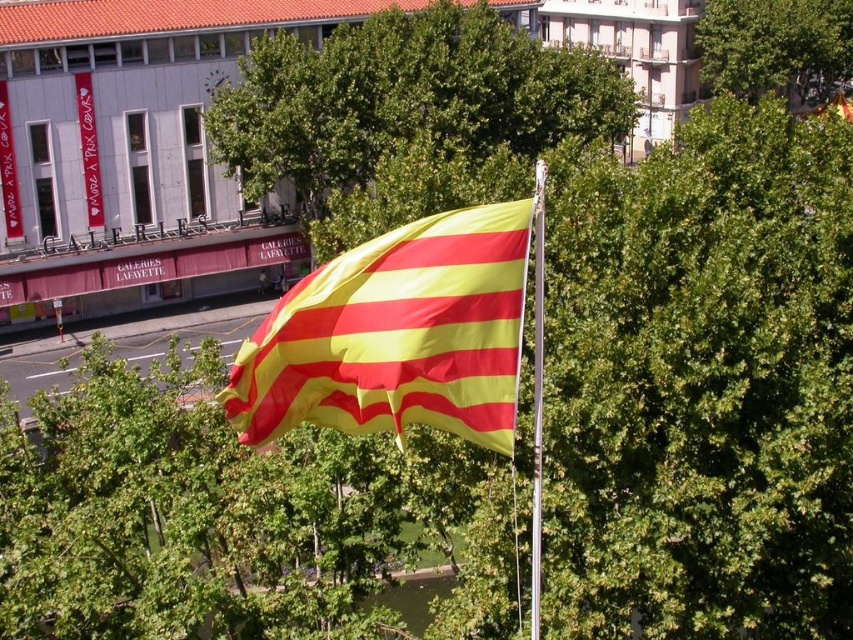
Who is taller, green leafy tree at center or green leafy tree at upper center?

With more height is green leafy tree at center.

Where is `green leafy tree at center`? Image resolution: width=853 pixels, height=640 pixels. green leafy tree at center is located at coordinates (405, 104).

The height and width of the screenshot is (640, 853). I want to click on green leafy tree at center, so click(x=405, y=104).

Is green leafy tree at upper center behind silver metallic flag pole at center?

Yes.

Where is `green leafy tree at upper center`? The width and height of the screenshot is (853, 640). green leafy tree at upper center is located at coordinates (775, 48).

You are a GUI agent. You are given a task and a screenshot of the screen. Output one action in this format:
    pyautogui.click(x=<x>, y=<y>)
    Task: Click on the green leafy tree at upper center
    This screenshot has height=640, width=853.
    Given the screenshot: What is the action you would take?
    pyautogui.click(x=775, y=48)

How distant is yellow/red striped fabric at center from silver metallic flag pole at center?

yellow/red striped fabric at center and silver metallic flag pole at center are 8.55 feet apart from each other.

Consider the image. Is yellow/red striped fabric at center positioned in front of silver metallic flag pole at center?

Yes.

Identify the location of yellow/red striped fabric at center. This screenshot has width=853, height=640. (396, 336).

This screenshot has height=640, width=853. What are the coordinates of `yellow/red striped fabric at center` in the screenshot? It's located at (396, 336).